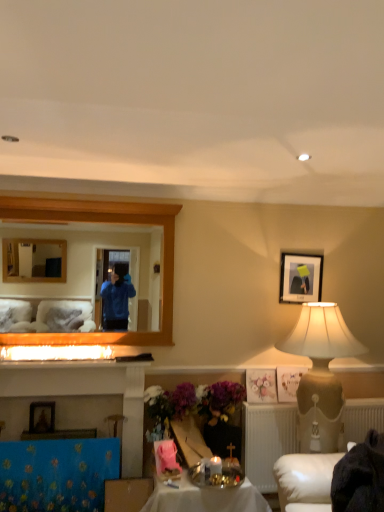
Where is `blue fabric tablecloth at lower left`? The width and height of the screenshot is (384, 512). blue fabric tablecloth at lower left is located at coordinates (57, 474).

The height and width of the screenshot is (512, 384). What do you see at coordinates (91, 263) in the screenshot?
I see `wooden frame mirror at upper left` at bounding box center [91, 263].

Identify the location of white textured radiator at lower right. (267, 440).

What do you see at coordinates (267, 440) in the screenshot? I see `white textured radiator at lower right` at bounding box center [267, 440].

Image resolution: width=384 pixels, height=512 pixels. Describe the element at coordinates (42, 417) in the screenshot. I see `wooden picture frame at lower left, the 1th picture frame viewed from the front` at that location.

Measure the distance between point [262,499] and camera.

The depth of point [262,499] is 8.86 feet.

What is the approximate height of pastel floral print at center?

pastel floral print at center is 8.81 inches tall.

Describe the element at coordinates (261, 386) in the screenshot. I see `pastel floral print at center` at that location.

At what (x,y) coordinates should I click in order to perform the action: click on beige textured lampshade at right. Please return your answer as a coordinate pair (x, y). The width and height of the screenshot is (384, 512). Looking at the image, I should click on (321, 335).

This screenshot has width=384, height=512. Find the location of `blue fabric tablecloth at lower left`. blue fabric tablecloth at lower left is located at coordinates (57, 474).

What are the coordinates of `mirror above the matte black picture frame at upper right, acting as the 1th picture frame starting from the back (from the image's perspective)` in the screenshot? It's located at (91, 263).

Is matte black picture frame at upper right, marked as the second picture frame in a left-to-right arrangement, oriented towards wooden frame mirror at upper left?

No, matte black picture frame at upper right, marked as the second picture frame in a left-to-right arrangement, is not oriented towards wooden frame mirror at upper left.

Are matte black picture frame at upper right, marked as the second picture frame in a left-to-right arrangement, and wooden frame mirror at upper left located far from each other?

That's right, there is a large distance between matte black picture frame at upper right, marked as the second picture frame in a left-to-right arrangement, and wooden frame mirror at upper left.

Which of these two, matte black picture frame at upper right, the 1th picture frame when ordered from right to left, or wooden frame mirror at upper left, is bigger?

wooden frame mirror at upper left is bigger.

Where is `the 1st picture frame behind the beige textured lampshade at right, counting from the anchor's position`? This screenshot has width=384, height=512. the 1st picture frame behind the beige textured lampshade at right, counting from the anchor's position is located at coordinates (42, 417).

From a real-world perspective, is wooden picture frame at lower left, the 2th picture frame in the top-to-bottom sequence, positioned over beige textured lampshade at right based on gravity?

Incorrect, from a real-world perspective, wooden picture frame at lower left, the 2th picture frame in the top-to-bottom sequence, is lower than beige textured lampshade at right.

Is wooden picture frame at lower left, placed as the first picture frame when sorted from left to right, smaller than beige textured lampshade at right?

Yes, wooden picture frame at lower left, placed as the first picture frame when sorted from left to right, is smaller than beige textured lampshade at right.

Is wooden picture frame at lower left, which is the 2th picture frame in back-to-front order, positioned far away from beige textured lampshade at right?

wooden picture frame at lower left, which is the 2th picture frame in back-to-front order, is far away from beige textured lampshade at right.

Can you confirm if wooden picture frame at lower left, the 1th picture frame viewed from the front, is positioned to the left of matte black picture frame at upper right, which ranks as the 2th picture frame in front-to-back order?

Yes, wooden picture frame at lower left, the 1th picture frame viewed from the front, is to the left of matte black picture frame at upper right, which ranks as the 2th picture frame in front-to-back order.

From a real-world perspective, is wooden picture frame at lower left, which is the second picture frame from right to left, below matte black picture frame at upper right, marked as the second picture frame in a left-to-right arrangement?

Yes, from a real-world perspective, wooden picture frame at lower left, which is the second picture frame from right to left, is below matte black picture frame at upper right, marked as the second picture frame in a left-to-right arrangement.

Is wooden picture frame at lower left, which is the second picture frame from right to left, spatially inside matte black picture frame at upper right, which ranks as the first picture frame in top-to-bottom order, or outside of it?

wooden picture frame at lower left, which is the second picture frame from right to left, exists outside the volume of matte black picture frame at upper right, which ranks as the first picture frame in top-to-bottom order.

From the image's perspective, is wooden picture frame at lower left, the 1th picture frame viewed from the front, above or below matte black picture frame at upper right, which ranks as the first picture frame in top-to-bottom order?

wooden picture frame at lower left, the 1th picture frame viewed from the front, is below matte black picture frame at upper right, which ranks as the first picture frame in top-to-bottom order.

Would you say wooden frame mirror at upper left is a long distance from matte black picture frame at upper right, which is the second picture frame in bottom-to-top order?

Yes, wooden frame mirror at upper left and matte black picture frame at upper right, which is the second picture frame in bottom-to-top order, are quite far apart.

From the image's perspective, is wooden frame mirror at upper left below matte black picture frame at upper right, acting as the 1th picture frame starting from the back?

No.

Which point is more distant from viewer, (81, 263) or (288, 301)?

The point (81, 263) is farther from the camera.

Does wooden frame mirror at upper left appear on the right side of matte black picture frame at upper right, which ranks as the first picture frame in top-to-bottom order?

Incorrect, wooden frame mirror at upper left is not on the right side of matte black picture frame at upper right, which ranks as the first picture frame in top-to-bottom order.

Considering the sizes of wooden frame mirror at upper left and wooden picture frame at lower left, placed as the first picture frame when sorted from left to right, in the image, is wooden frame mirror at upper left taller or shorter than wooden picture frame at lower left, placed as the first picture frame when sorted from left to right,?

Clearly, wooden frame mirror at upper left is taller compared to wooden picture frame at lower left, placed as the first picture frame when sorted from left to right.

From a real-world perspective, is wooden frame mirror at upper left physically located above or below wooden picture frame at lower left, which is the second picture frame from right to left?

wooden frame mirror at upper left is above wooden picture frame at lower left, which is the second picture frame from right to left.

Find the location of a particular element. mirror located in front of the wooden picture frame at lower left, the first picture frame when ordered from bottom to top is located at coordinates (91, 263).

Is the depth of wooden frame mirror at upper left less than that of wooden picture frame at lower left, the 2th picture frame in the top-to-bottom sequence?

Yes, the depth of wooden frame mirror at upper left is less than that of wooden picture frame at lower left, the 2th picture frame in the top-to-bottom sequence.

Is blue fabric tablecloth at lower left taller or shorter than shiny metallic tray at center?

blue fabric tablecloth at lower left is taller than shiny metallic tray at center.

Does point (61, 474) appear closer or farther from the camera than point (188, 495)?

Point (61, 474) appears to be farther away from the viewer than point (188, 495).

Does blue fabric tablecloth at lower left turn towards shiny metallic tray at center?

No.

From a real-world perspective, between blue fabric tablecloth at lower left and shiny metallic tray at center, who is vertically lower?

shiny metallic tray at center.

From the picture: Between wooden frame mirror at upper left and blue fabric tablecloth at lower left, which one has larger size?

wooden frame mirror at upper left.

Consider the image. Is wooden frame mirror at upper left turned away from blue fabric tablecloth at lower left?

wooden frame mirror at upper left is not turned away from blue fabric tablecloth at lower left.

Which is correct: wooden frame mirror at upper left is inside blue fabric tablecloth at lower left, or outside of it?

wooden frame mirror at upper left is located beyond the bounds of blue fabric tablecloth at lower left.

At what (x,y) coordinates should I click in order to perform the action: click on mirror lying on the left of matte black picture frame at upper right, which ranks as the first picture frame in top-to-bottom order. Please return your answer as a coordinate pair (x, y). Looking at the image, I should click on (91, 263).

Identify the location of table lamp above the wooden picture frame at lower left, the 2th picture frame in the top-to-bottom sequence (from a real-world perspective). Image resolution: width=384 pixels, height=512 pixels. (321, 335).

Looking at the image, which one is located closer to wooden picture frame at lower left, which is the 2th picture frame in back-to-front order, pastel floral print at center or shiny metallic tray at center?

shiny metallic tray at center is closer to wooden picture frame at lower left, which is the 2th picture frame in back-to-front order.

Considering their positions, is shiny metallic tray at center positioned further to matte black picture frame at upper right, which ranks as the 2th picture frame in front-to-back order, than wooden picture frame at lower left, the first picture frame when ordered from bottom to top?

wooden picture frame at lower left, the first picture frame when ordered from bottom to top, lies further to matte black picture frame at upper right, which ranks as the 2th picture frame in front-to-back order, than the other object.

Estimate the real-world distances between objects in this image. Which object is further from pastel floral print at center, blue fabric tablecloth at lower left or wooden frame mirror at upper left?

The object further to pastel floral print at center is wooden frame mirror at upper left.

Which object lies nearer to the anchor point matte black picture frame at upper right, acting as the 1th picture frame starting from the back, pastel floral print at center or white textured radiator at lower right?

pastel floral print at center is positioned closer to the anchor matte black picture frame at upper right, acting as the 1th picture frame starting from the back.

When comparing their distances from wooden frame mirror at upper left, does beige textured lampshade at right or shiny metallic tray at center seem further?

shiny metallic tray at center is further to wooden frame mirror at upper left.

Based on their spatial positions, is wooden frame mirror at upper left or beige textured lampshade at right further from white textured radiator at lower right?

wooden frame mirror at upper left lies further to white textured radiator at lower right than the other object.

Based on their spatial positions, is blue fabric tablecloth at lower left or matte black picture frame at upper right, which ranks as the 2th picture frame in front-to-back order, further from wooden picture frame at lower left, placed as the first picture frame when sorted from left to right?

matte black picture frame at upper right, which ranks as the 2th picture frame in front-to-back order.

From the image, which object appears to be farther from wooden frame mirror at upper left, matte black picture frame at upper right, marked as the second picture frame in a left-to-right arrangement, or beige textured lampshade at right?

beige textured lampshade at right lies further to wooden frame mirror at upper left than the other object.

Locate an element on the screen. The width and height of the screenshot is (384, 512). picture frame located between blue fabric tablecloth at lower left and white textured radiator at lower right in the left-right direction is located at coordinates (300, 277).

This screenshot has width=384, height=512. What are the coordinates of `table situated between wooden picture frame at lower left, placed as the first picture frame when sorted from left to right, and pastel floral print at center from left to right` in the screenshot? It's located at (205, 498).

Find the location of `table situated between wooden frame mirror at upper left and white textured radiator at lower right from left to right`. table situated between wooden frame mirror at upper left and white textured radiator at lower right from left to right is located at coordinates (205, 498).

Where is `flower between wooden picture frame at lower left, placed as the first picture frame when sorted from left to right, and matte black picture frame at upper right, which ranks as the 2th picture frame in front-to-back order, from left to right`? This screenshot has height=512, width=384. flower between wooden picture frame at lower left, placed as the first picture frame when sorted from left to right, and matte black picture frame at upper right, which ranks as the 2th picture frame in front-to-back order, from left to right is located at coordinates (261, 386).